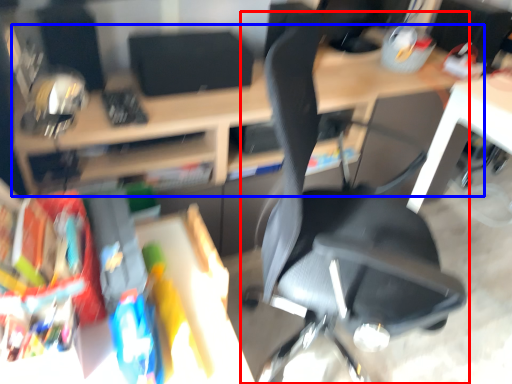
Question: Which point is further to the camera, chair (highlighted by a red box) or desk (highlighted by a blue box)?

Choices:
 (A) chair
 (B) desk

Answer: (B)